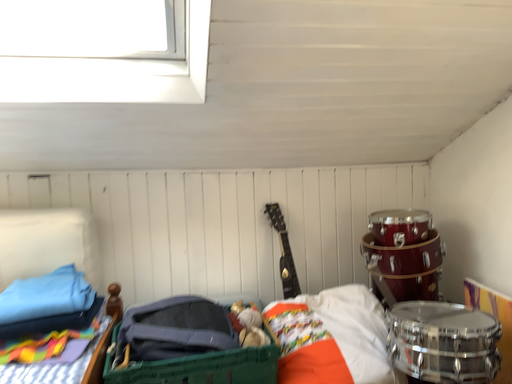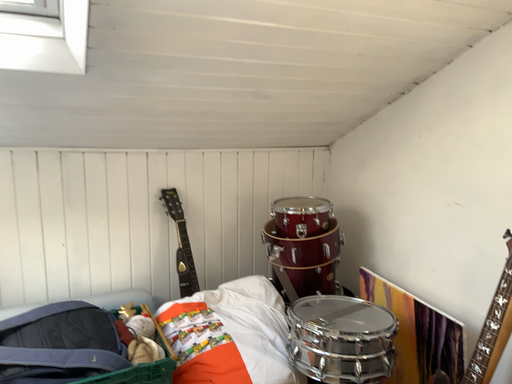
Question: How did the camera likely rotate when shooting the video?

Choices:
 (A) rotated right
 (B) rotated left

Answer: (A)